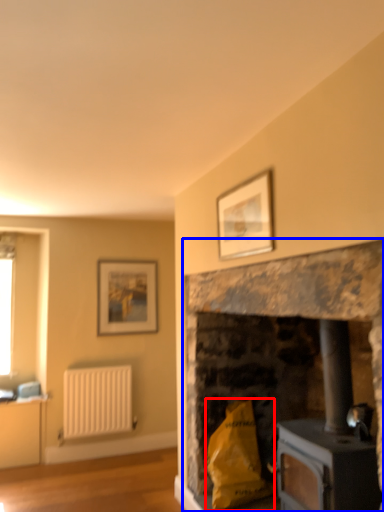
Question: Which object appears farthest to the camera in this image, material (highlighted by a red box) or fireplace (highlighted by a blue box)?

Choices:
 (A) material
 (B) fireplace

Answer: (A)